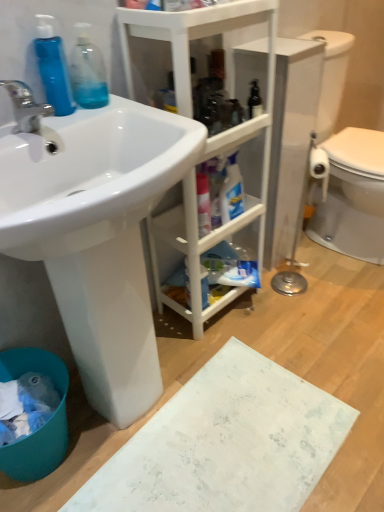
Locate an element on the screen. This screenshot has width=384, height=512. vacant space in front of transparent plastic bottle at upper left, the 2th cleaning product when ordered from left to right is located at coordinates click(74, 119).